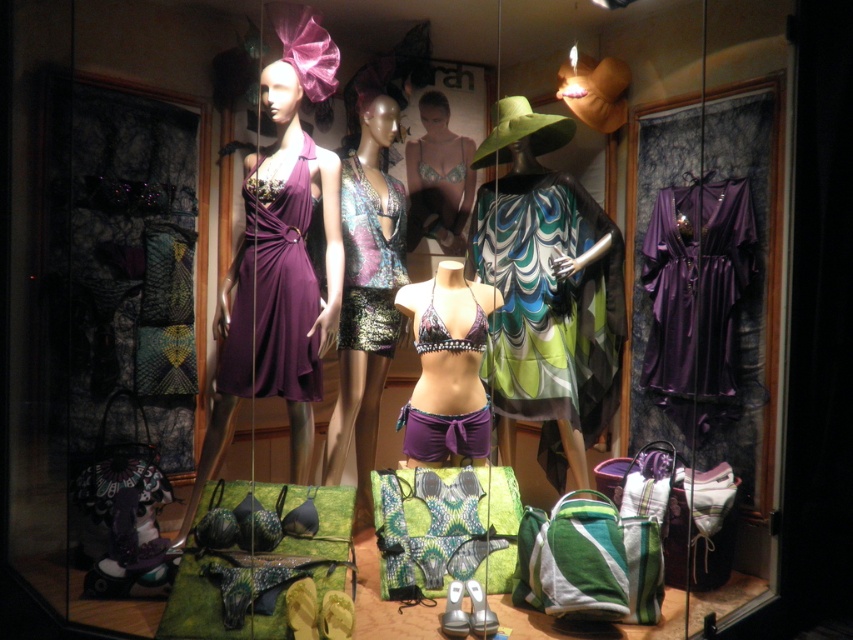
You are a customer looking at the retail display window. You want to find the satin purple dress at right. Based on the coordinates provided, where should you look in the window display?

The satin purple dress at right is located at the coordinates point (697, 300) in the window display.

You are a store employee arranging items in the display window. You need to place a new accessory that requires 1.2 meters of space. The accessory must be placed between the satin purple dress at right and the metallic sequined bikini top at center. Is there enough space between them to accommodate the accessory?

The satin purple dress at right is wider than the metallic sequined bikini top at center. However, the question is about the space between them, not their widths. The provided information does not specify the distance between the two items, so we cannot determine if there is enough space for the accessory based on the given details.